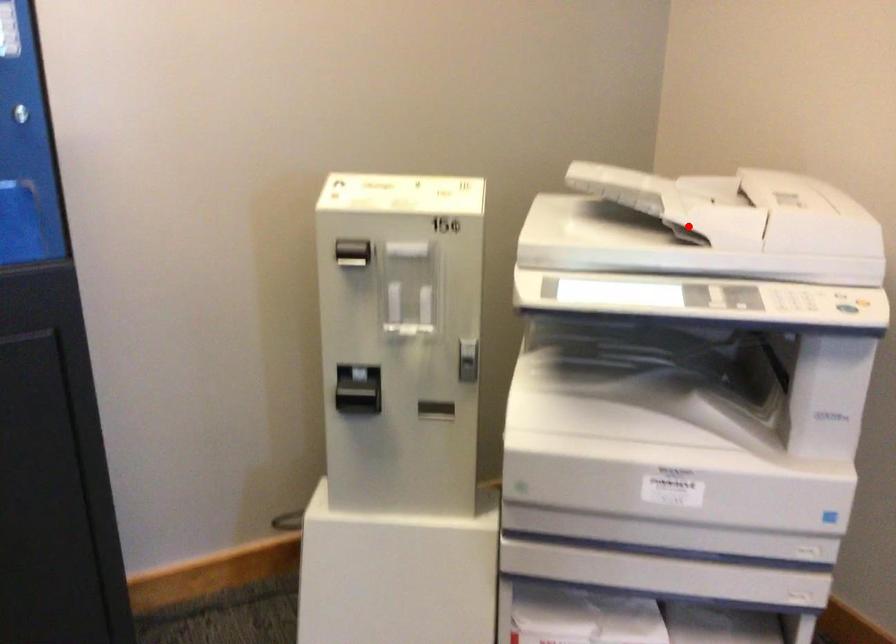
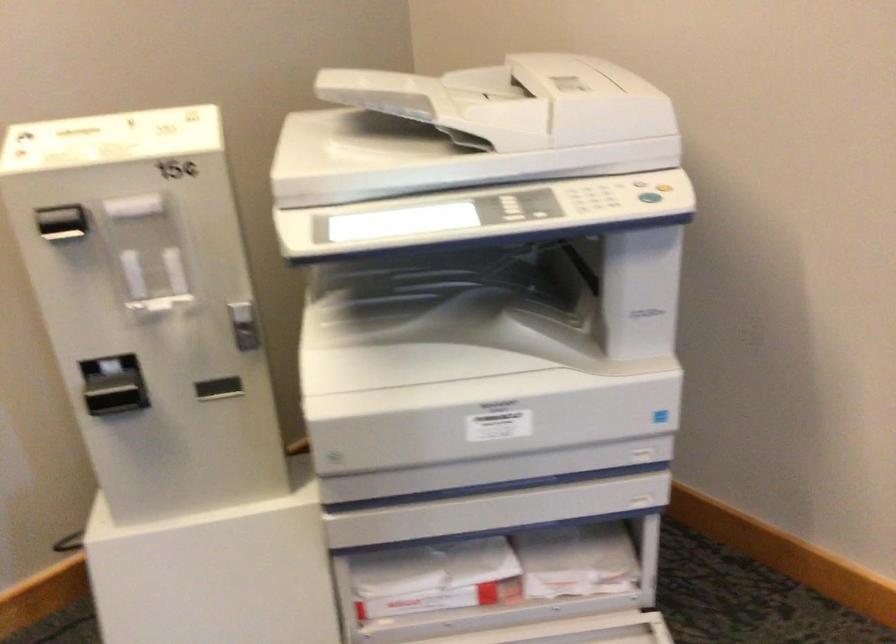
Question: I am providing you with two images of the same scene from different viewpoints. Given a red point in image1, look at the same physical point in image2. Is it:

Choices:
 (A) Closer to the viewpoint
 (B) Farther from the viewpoint

Answer: (A)